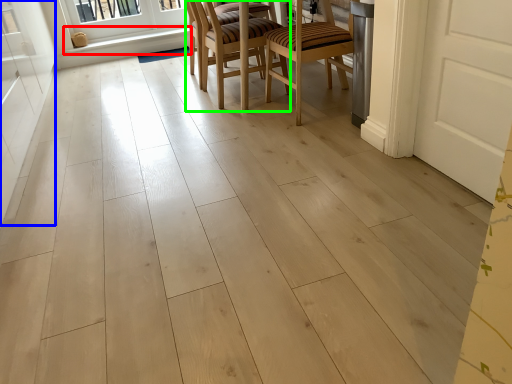
Question: Based on their relative distances, which object is nearer to window sill (highlighted by a red box)? Choose from screen door (highlighted by a blue box) and chair (highlighted by a green box).

Choices:
 (A) screen door
 (B) chair

Answer: (A)